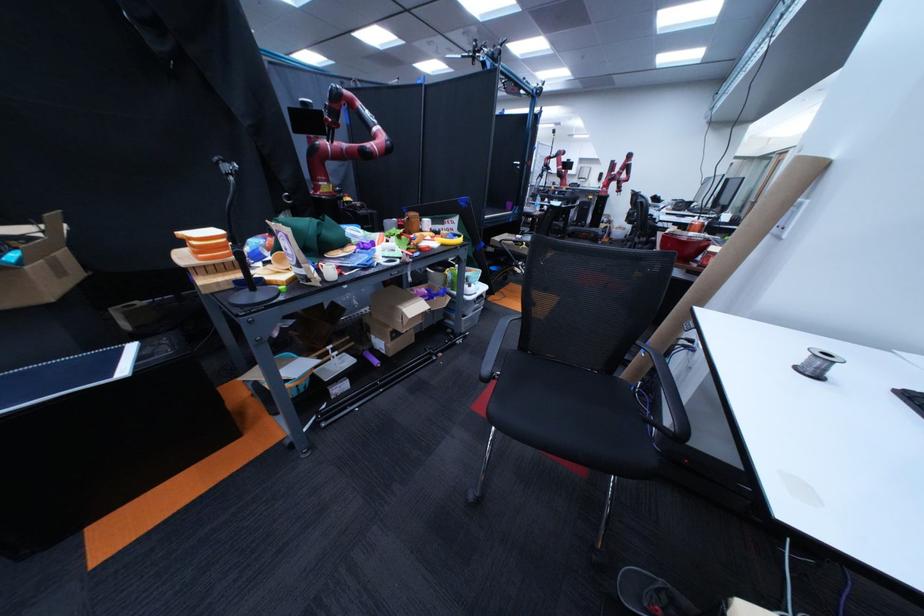
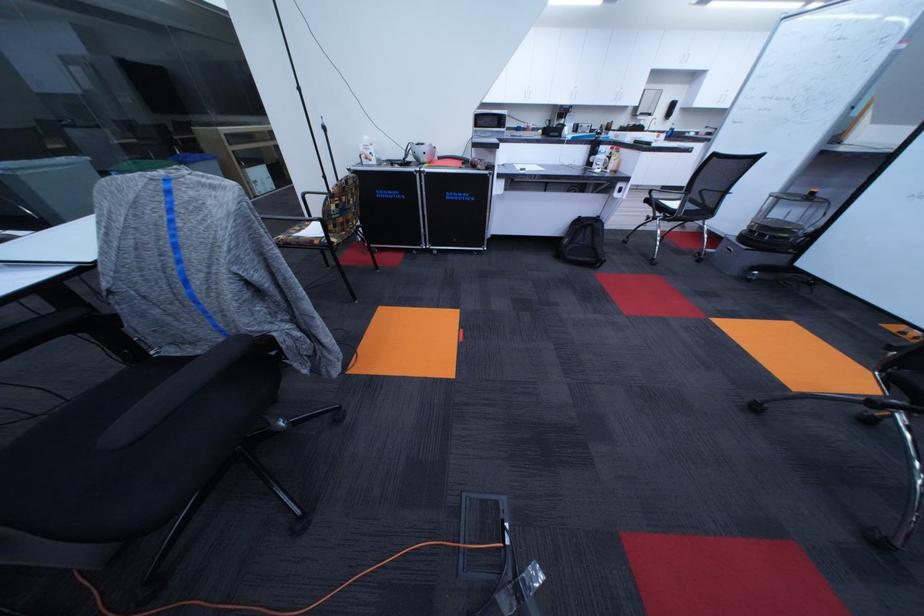
The point at (614, 176) is marked in the first image. Where is the corresponding point in the second image?

(686, 107)